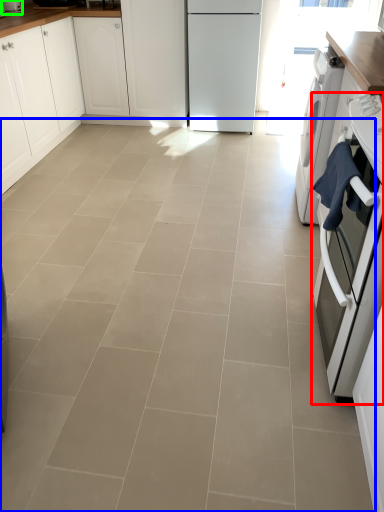
Question: Considering the real-world distances, which object is farthest from home appliance (highlighted by a red box)? ceramic tile (highlighted by a blue box) or kitchen appliance (highlighted by a green box)?

Choices:
 (A) ceramic tile
 (B) kitchen appliance

Answer: (B)